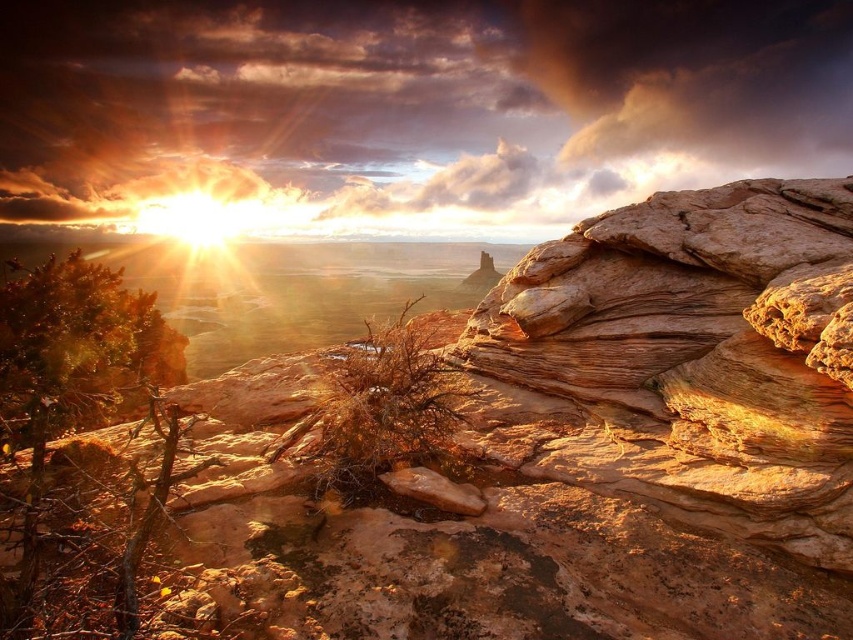
Question: Where is rustic sandstone rock at center located in relation to cloudy textured sky at upper center in the image?

Choices:
 (A) above
 (B) below

Answer: (B)

Question: Which point is farther to the camera?

Choices:
 (A) (360, 406)
 (B) (519, 157)

Answer: (B)

Question: Is rustic sandstone rock at center further to the viewer compared to cloudy textured sky at upper center?

Choices:
 (A) yes
 (B) no

Answer: (B)

Question: Can you confirm if rustic sandstone rock at center is smaller than cloudy textured sky at upper center?

Choices:
 (A) yes
 (B) no

Answer: (A)

Question: Which point is closer to the camera?

Choices:
 (A) (401, 68)
 (B) (109, 435)

Answer: (B)